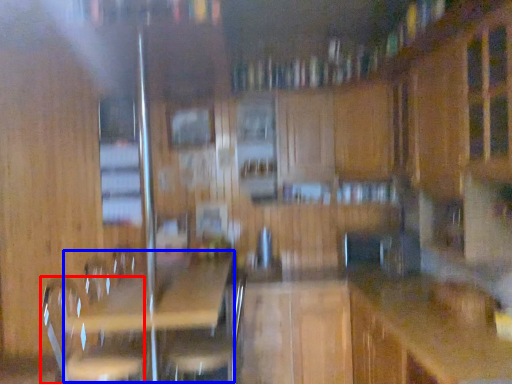
Question: Which object appears closest to the camera in this image, swivel chair (highlighted by a red box) or picnic table (highlighted by a blue box)?

Choices:
 (A) swivel chair
 (B) picnic table

Answer: (B)